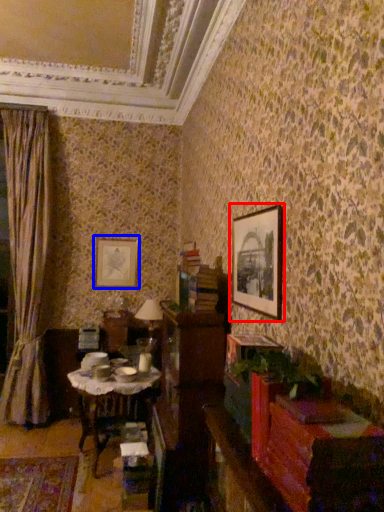
Question: Which object is closer to the camera taking this photo, picture frame (highlighted by a red box) or picture frame (highlighted by a blue box)?

Choices:
 (A) picture frame
 (B) picture frame

Answer: (A)